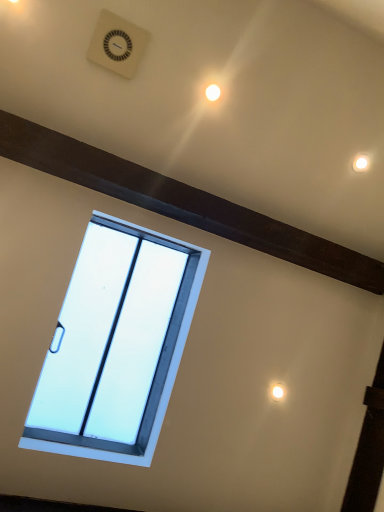
Question: Does white plastic clock at upper center have a larger size compared to white plastic window at center?

Choices:
 (A) no
 (B) yes

Answer: (A)

Question: Is white plastic clock at upper center at the left side of white plastic window at center?

Choices:
 (A) yes
 (B) no

Answer: (B)

Question: Can you confirm if white plastic clock at upper center is taller than white plastic window at center?

Choices:
 (A) yes
 (B) no

Answer: (B)

Question: From a real-world perspective, is white plastic clock at upper center below white plastic window at center?

Choices:
 (A) yes
 (B) no

Answer: (B)

Question: Is white plastic clock at upper center facing towards white plastic window at center?

Choices:
 (A) no
 (B) yes

Answer: (A)

Question: Is white glossy light at upper center bigger or smaller than white plastic clock at upper center?

Choices:
 (A) small
 (B) big

Answer: (A)

Question: From their relative heights in the image, would you say white glossy light at upper center is taller or shorter than white plastic clock at upper center?

Choices:
 (A) short
 (B) tall

Answer: (A)

Question: Visually, is white glossy light at upper center positioned to the left or to the right of white plastic clock at upper center?

Choices:
 (A) right
 (B) left

Answer: (A)

Question: From the image's perspective, is white glossy light at upper center above or below white plastic clock at upper center?

Choices:
 (A) below
 (B) above

Answer: (A)

Question: In terms of height, does white plastic clock at upper center look taller or shorter compared to white plastic window at center?

Choices:
 (A) tall
 (B) short

Answer: (B)

Question: Is white plastic clock at upper center situated inside white plastic window at center or outside?

Choices:
 (A) outside
 (B) inside

Answer: (A)

Question: From the image's perspective, is white plastic clock at upper center positioned above or below white plastic window at center?

Choices:
 (A) below
 (B) above

Answer: (B)

Question: Looking at the image, does white plastic clock at upper center seem bigger or smaller compared to white plastic window at center?

Choices:
 (A) small
 (B) big

Answer: (A)

Question: From a real-world perspective, relative to white glossy light at upper center, is white plastic window at center vertically above or below?

Choices:
 (A) above
 (B) below

Answer: (B)

Question: From the image's perspective, is white plastic window at center above or below white glossy light at upper center?

Choices:
 (A) below
 (B) above

Answer: (A)